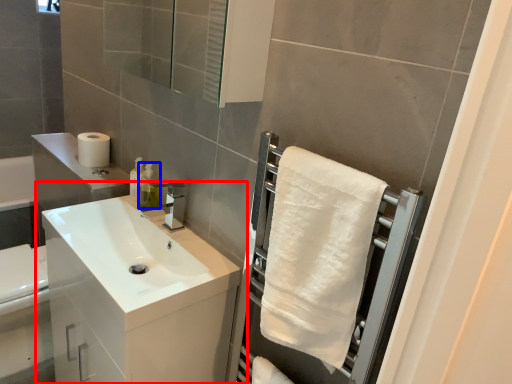
Question: Which object appears closest to the camera in this image, bathroom cabinet (highlighted by a red box) or soap dispenser (highlighted by a blue box)?

Choices:
 (A) bathroom cabinet
 (B) soap dispenser

Answer: (A)